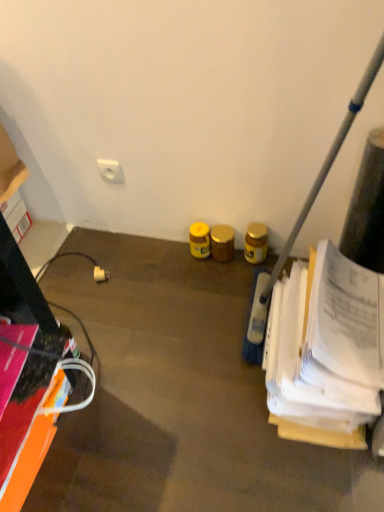
Describe the element at coordinates (325, 351) in the screenshot. I see `white paper at right` at that location.

Identify the location of white paper at right. (325, 351).

Identify the location of white paper at right. (325, 351).